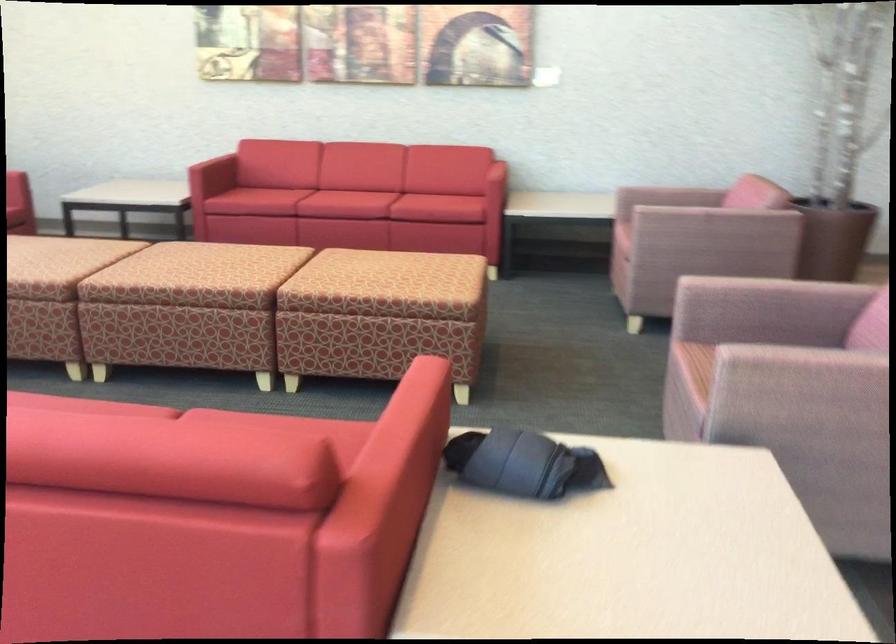
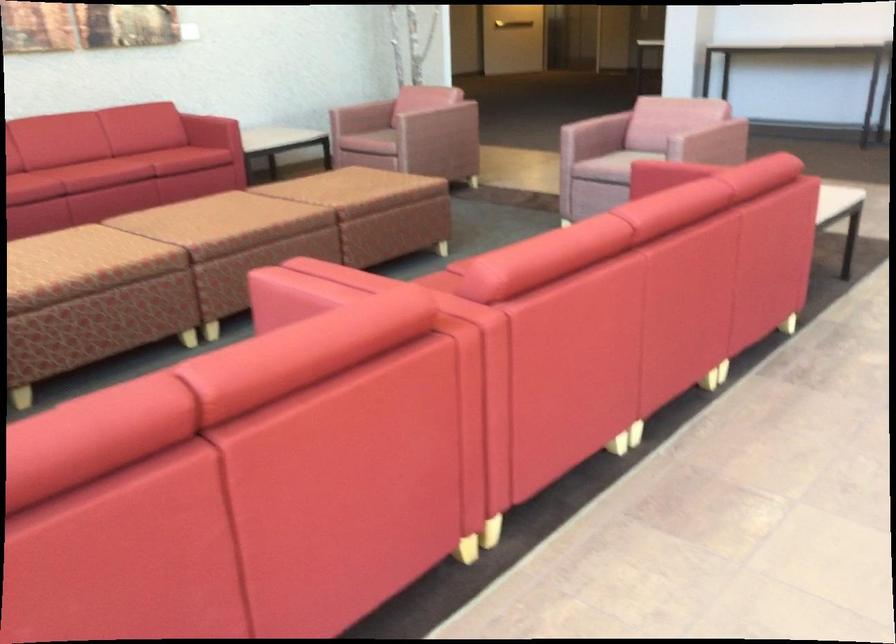
Question: I am providing you with two images of the same scene from different viewpoints. Which of the following objects are not visible in image2?

Choices:
 (A) red sofa armrest
 (B) red sofa sitting surface
 (C) horizontal door handle
 (D) dark grey mug

Answer: (A)